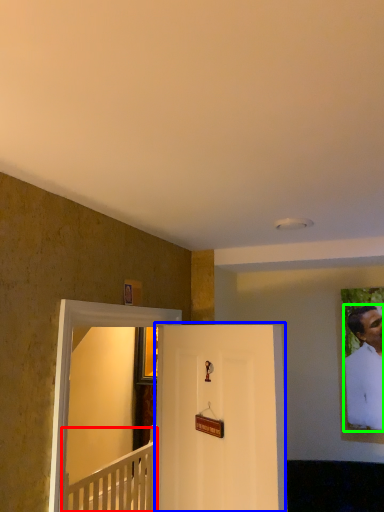
Question: Which is farther away from furniture (highlighted by a red box)? door (highlighted by a blue box) or man (highlighted by a green box)?

Choices:
 (A) door
 (B) man

Answer: (B)